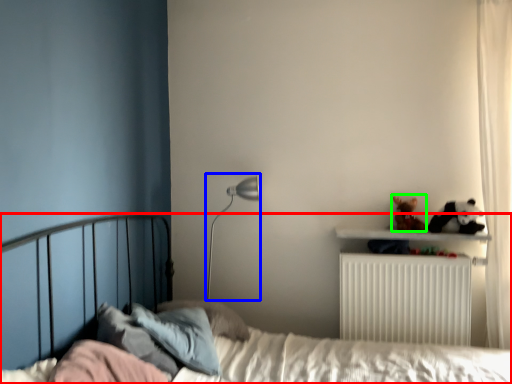
Question: Which object is the closest to the bed (highlighted by a red box)? Choose among these: table lamp (highlighted by a blue box) or toy (highlighted by a green box).

Choices:
 (A) table lamp
 (B) toy

Answer: (B)